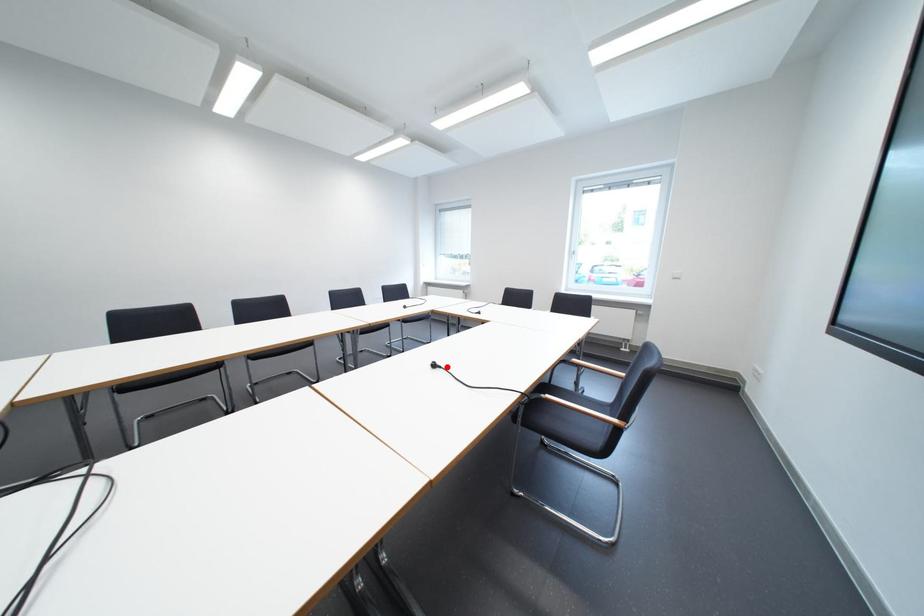
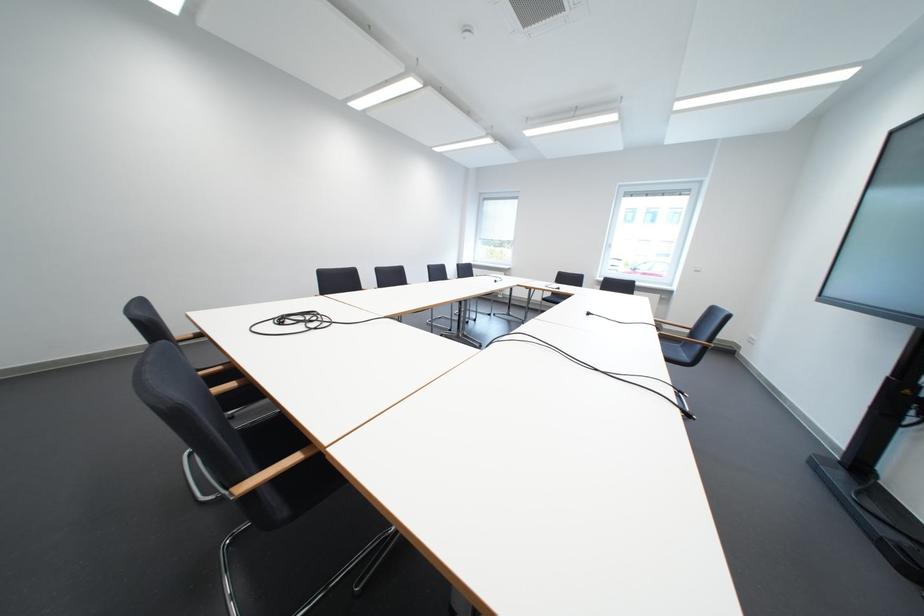
Question: I am providing you with two images of the same scene from different viewpoints. In image1, a red point is highlighted. Considering the same 3D point in image2, which of the following is correct?

Choices:
 (A) It is closer
 (B) It is farther

Answer: (B)